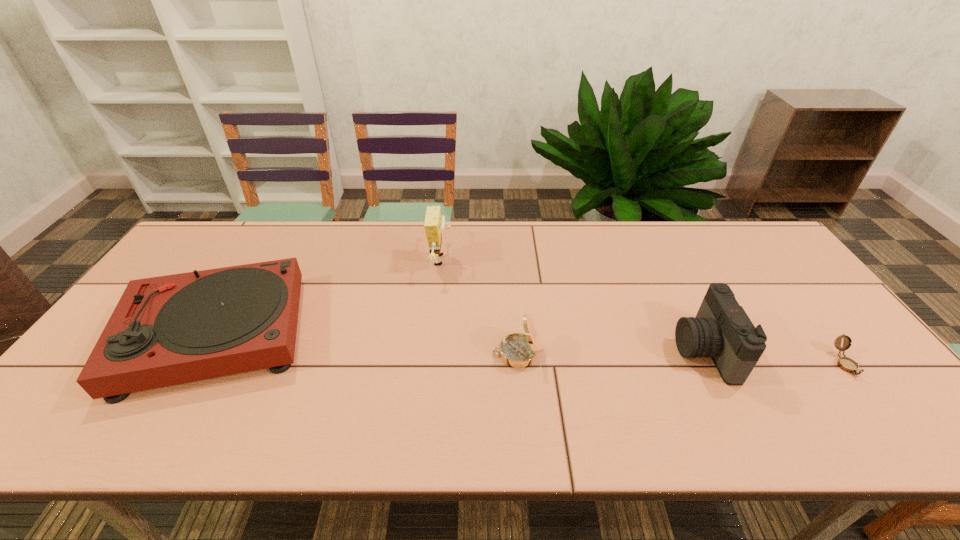
Find the location of `object located at the right edge`. object located at the right edge is located at coordinates (847, 364).

In the image, there is a desktop. Identify the location of free space at the far edge. Image resolution: width=960 pixels, height=540 pixels. (447, 233).

Image resolution: width=960 pixels, height=540 pixels. In order to click on vacant region at the near edge of the desktop in this screenshot , I will do `click(435, 422)`.

I want to click on free region at the right edge of the desktop, so click(x=885, y=400).

The height and width of the screenshot is (540, 960). In the image, there is a desktop. Find the location of `vacant region at the far left corner`. vacant region at the far left corner is located at coordinates (200, 237).

In the image, there is a desktop. Where is `vacant space at the far right corner`? The width and height of the screenshot is (960, 540). vacant space at the far right corner is located at coordinates [732, 221].

Locate an element on the screen. vacant space at the near right corner is located at coordinates (866, 421).

Find the location of a particular element. This screenshot has width=960, height=540. vacant area that lies between the record player and the third object from left to right is located at coordinates [366, 343].

Locate an element on the screen. Image resolution: width=960 pixels, height=540 pixels. free space between the second object from left to right and the leftmost object is located at coordinates (328, 297).

The width and height of the screenshot is (960, 540). Find the location of `empty location between the leftmost object and the second object from right to left`. empty location between the leftmost object and the second object from right to left is located at coordinates (460, 342).